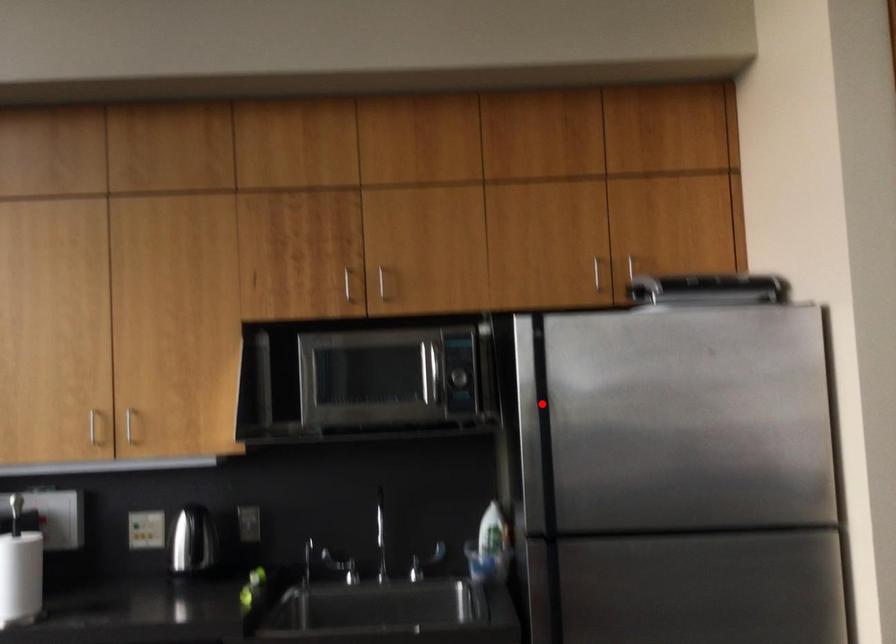
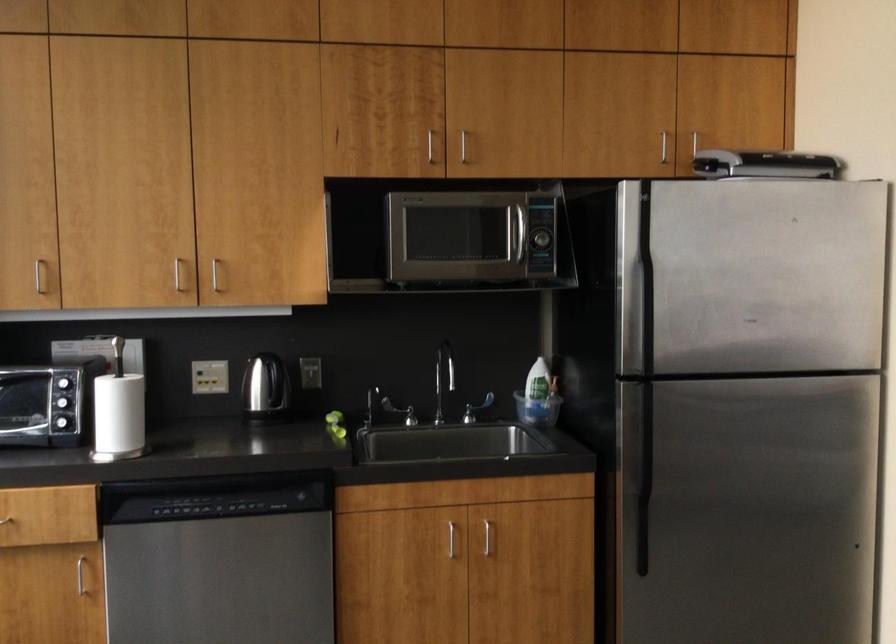
In the second image, find the point that corresponds to the highlighted location in the first image.

(636, 267)